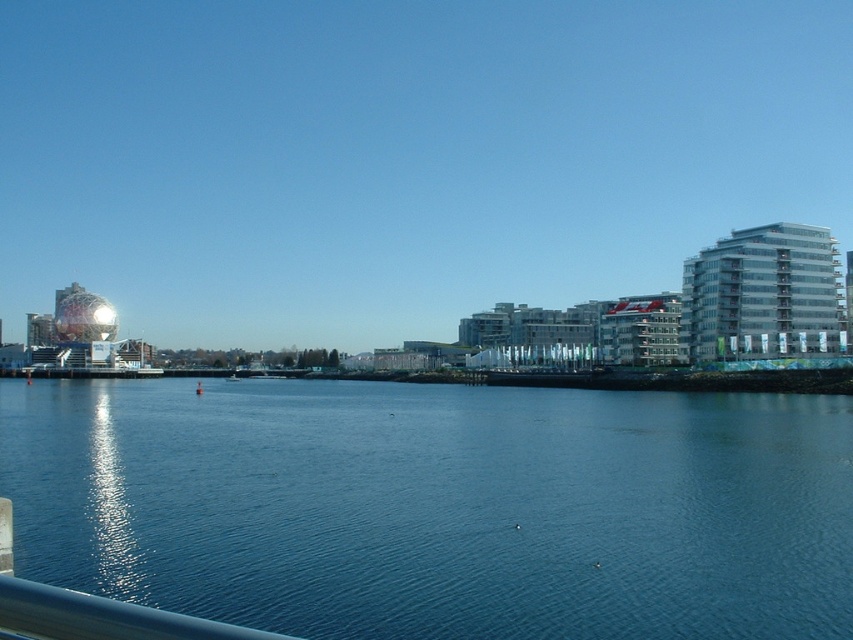
Question: Does blue water at center have a larger size compared to metallic blue rail at lower left?

Choices:
 (A) yes
 (B) no

Answer: (A)

Question: From the image, what is the correct spatial relationship of blue water at center in relation to metallic blue rail at lower left?

Choices:
 (A) right
 (B) left

Answer: (B)

Question: Which object appears farthest from the camera in this image?

Choices:
 (A) metallic blue rail at lower left
 (B) blue water at center

Answer: (B)

Question: Is blue water at center above metallic blue rail at lower left?

Choices:
 (A) yes
 (B) no

Answer: (B)